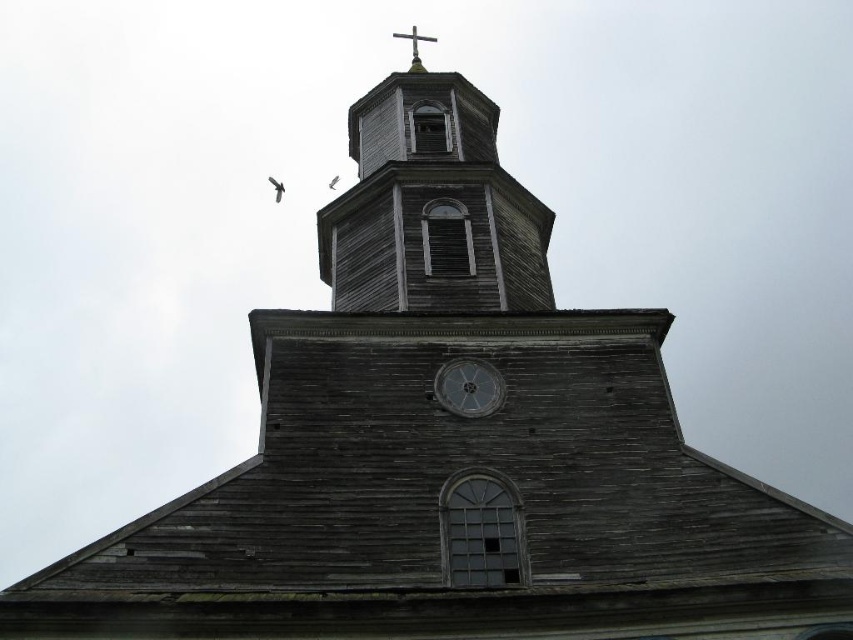
Looking at the church from the front, you notice the metallic gray clock at center and the metallic cross at top. Which of these two objects is larger in size?

The metallic gray clock at center is smaller than the metallic cross at top, so the metallic cross at top is larger in size.

You are an architect examining the church structure. You notice the weathered wood clock tower at upper center and the metallic gray clock at center. Which object is located to the left of the other?

The weathered wood clock tower at upper center is positioned on the left side of metallic gray clock at center.

You are standing in front of the church and notice a point marked at coordinates (468, 387). Which object is this point located on?

The point at (468, 387) is located on the metallic gray clock at center.